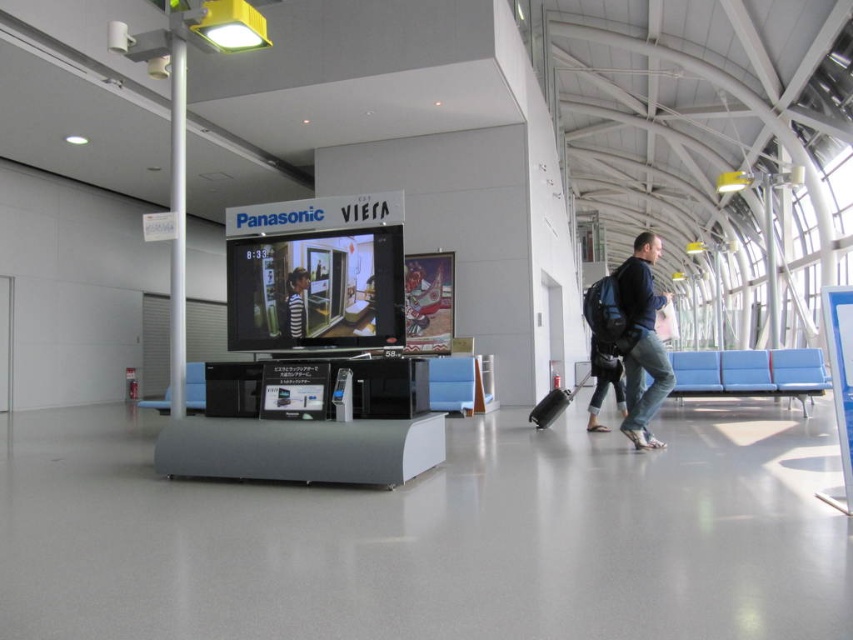
Is dark blue jeans at right taller than striped fabric shirt at center?

No, dark blue jeans at right is not taller than striped fabric shirt at center.

Is point (666, 380) closer to camera compared to point (303, 317)?

No.

Which is behind, point (631, 369) or point (287, 312)?

Positioned behind is point (631, 369).

Locate an element on the screen. The height and width of the screenshot is (640, 853). dark blue jeans at right is located at coordinates (641, 340).

Does dark blue jeans at right have a larger size compared to black matte suitcase at center?

Actually, dark blue jeans at right might be smaller than black matte suitcase at center.

Between dark blue jeans at right and black matte suitcase at center, which one has more height?

black matte suitcase at center is taller.

Where is `dark blue jeans at right`? dark blue jeans at right is located at coordinates (641, 340).

Measure the distance between striped fabric shirt at center and black matte suitcase at center.

3.36 meters

Is point (300, 273) more distant than point (560, 413)?

No, (300, 273) is closer to viewer.

Which is behind, point (305, 321) or point (575, 390)?

The point (575, 390) is more distant.

Image resolution: width=853 pixels, height=640 pixels. Identify the location of striped fabric shirt at center. (x=296, y=301).